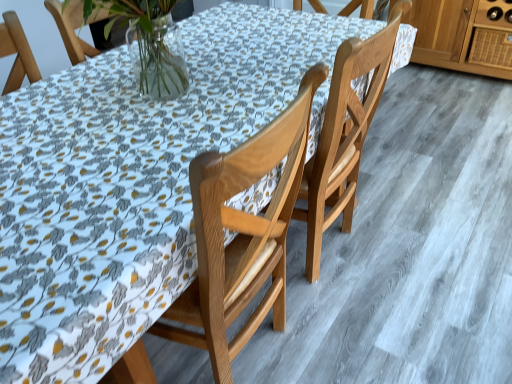
Question: Is wooden drawer at upper right looking in the opposite direction of wooden chair at center, acting as the second chair starting from the right?

Choices:
 (A) yes
 (B) no

Answer: (B)

Question: Is wooden chair at center, acting as the second chair starting from the right, inside wooden drawer at upper right?

Choices:
 (A) no
 (B) yes

Answer: (A)

Question: Can you confirm if wooden drawer at upper right is smaller than wooden chair at center, acting as the second chair starting from the right?

Choices:
 (A) yes
 (B) no

Answer: (A)

Question: Is wooden drawer at upper right facing towards wooden chair at center, which is the 1th chair from left to right?

Choices:
 (A) no
 (B) yes

Answer: (B)

Question: Is wooden drawer at upper right thinner than wooden chair at center, which is the 1th chair from left to right?

Choices:
 (A) no
 (B) yes

Answer: (B)

Question: Is there a large distance between wooden drawer at upper right and wooden chair at center, acting as the second chair starting from the right?

Choices:
 (A) no
 (B) yes

Answer: (B)

Question: Is wooden chair at center, acting as the second chair starting from the right, outside of wooden drawer at upper right?

Choices:
 (A) no
 (B) yes

Answer: (B)

Question: Does wooden chair at center, acting as the second chair starting from the right, have a greater width compared to wooden drawer at upper right?

Choices:
 (A) no
 (B) yes

Answer: (B)

Question: From a real-world perspective, is wooden chair at center, which is the 1th chair from left to right, located beneath wooden drawer at upper right?

Choices:
 (A) no
 (B) yes

Answer: (A)

Question: Is wooden chair at center, which is the 1th chair from left to right, taller than wooden drawer at upper right?

Choices:
 (A) yes
 (B) no

Answer: (A)

Question: From the image's perspective, is wooden chair at center, acting as the second chair starting from the right, located above wooden drawer at upper right?

Choices:
 (A) no
 (B) yes

Answer: (A)

Question: Does wooden chair at center, which is the 1th chair from left to right, turn towards wooden drawer at upper right?

Choices:
 (A) yes
 (B) no

Answer: (B)

Question: Are wooden drawer at upper right and light brown wood chair at center, which is the 1th chair in right-to-left order, making contact?

Choices:
 (A) yes
 (B) no

Answer: (B)